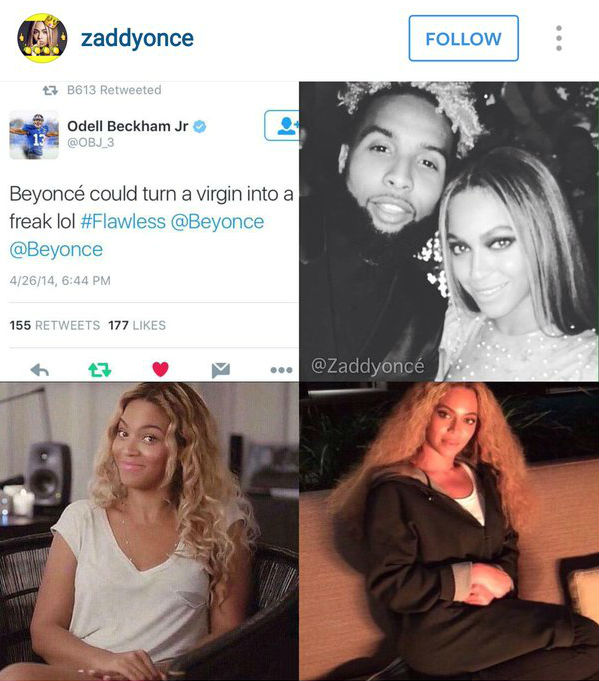
Identify the location of speaker. (54, 473).